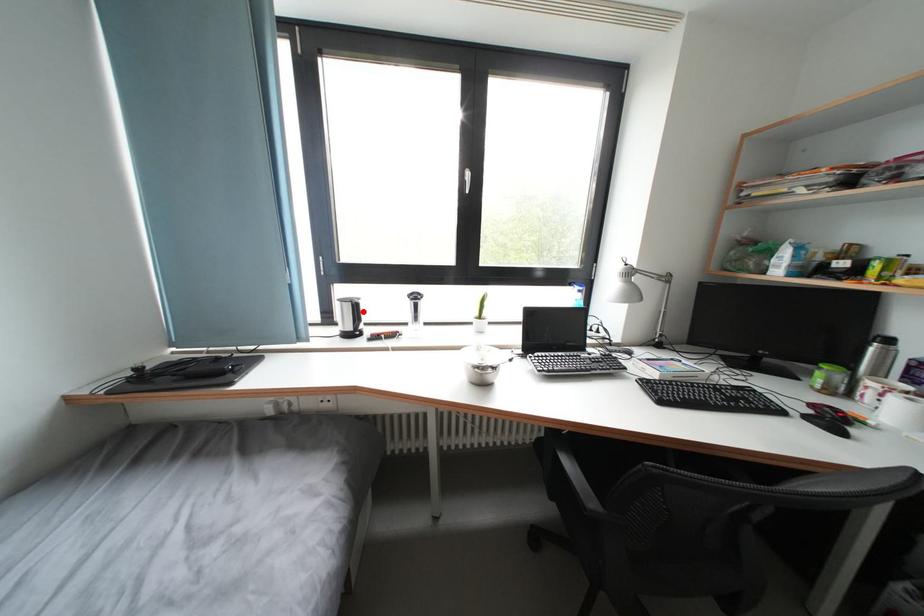
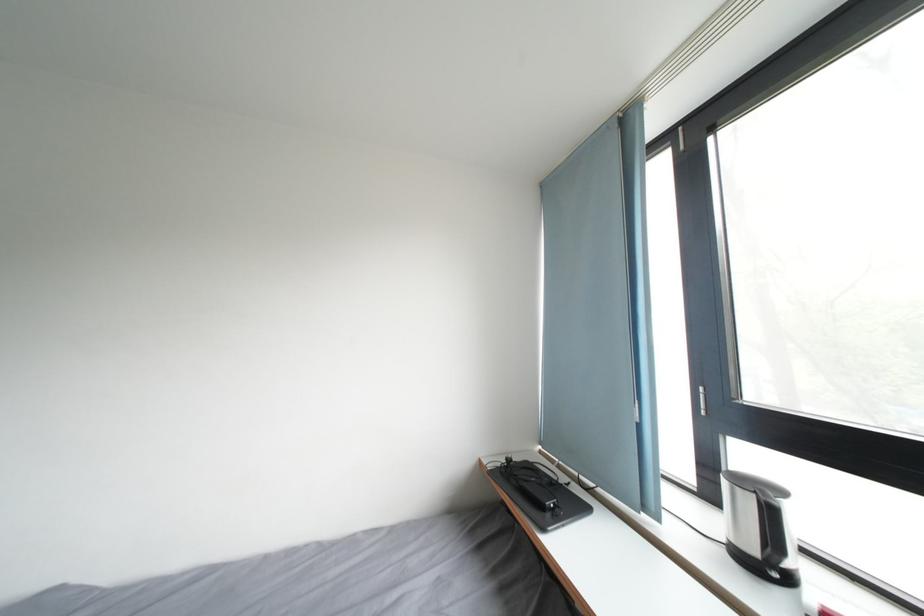
Question: I am providing you with two images of the same scene from different viewpoints. A red point is marked on the first image. At the location where the point appears in image 1, is it still visible in image 2?

Choices:
 (A) Yes
 (B) No

Answer: (A)